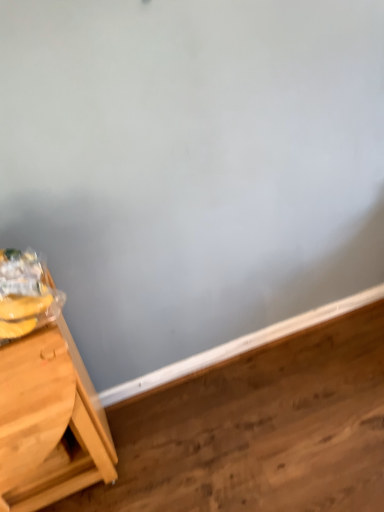
Where is `vacant space to the right of light brown wooden table at left`? Image resolution: width=384 pixels, height=512 pixels. vacant space to the right of light brown wooden table at left is located at coordinates (159, 450).